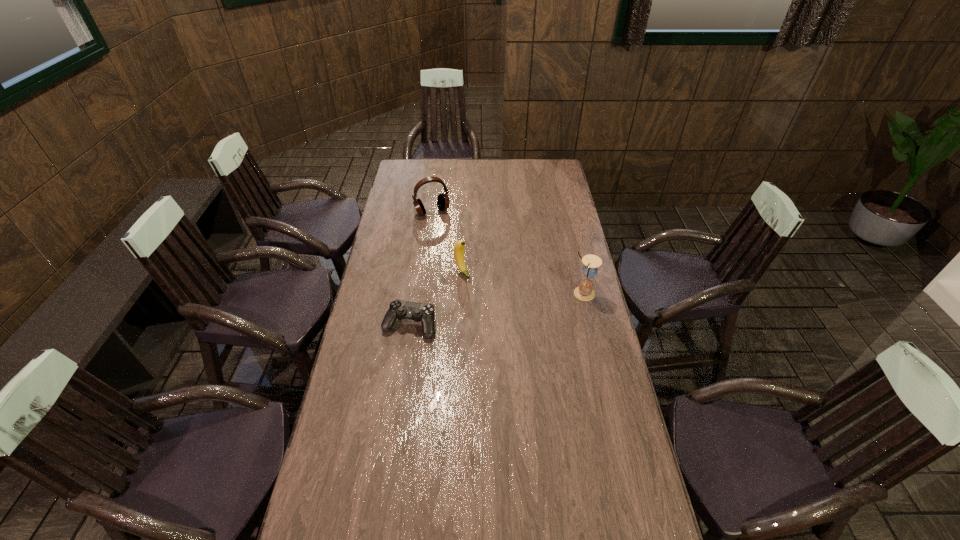
Identify the location of the shortest object. (425, 313).

This screenshot has width=960, height=540. Identify the location of the nearest object. (425, 313).

Image resolution: width=960 pixels, height=540 pixels. Find the location of `the rightmost object`. the rightmost object is located at coordinates (584, 291).

At what (x,y) coordinates should I click in order to perform the action: click on hourglass. Please return your answer as a coordinate pair (x, y). The image size is (960, 540). Looking at the image, I should click on (584, 291).

The height and width of the screenshot is (540, 960). What are the coordinates of `banana` in the screenshot? It's located at (459, 247).

At what (x,y) coordinates should I click in order to perform the action: click on the third object from left to right. Please return your answer as a coordinate pair (x, y). Looking at the image, I should click on click(x=459, y=247).

Find the location of a particular element. The width and height of the screenshot is (960, 540). headset is located at coordinates (443, 202).

You are a GUI agent. You are given a task and a screenshot of the screen. Output one action in this format:
    pyautogui.click(x=<x>, y=<y>)
    Task: Click on the vacant position located 0.110m on the right of the shortest object
    The image size is (960, 540).
    Given the screenshot: What is the action you would take?
    pyautogui.click(x=466, y=325)

Identify the location of vacant area situated on the back of the rightmost object. (572, 244).

You are a GUI agent. You are given a task and a screenshot of the screen. Output one action in this format:
    pyautogui.click(x=<x>, y=<y>)
    Task: Click on the vacant space situated from the stem of the second object from right to left
    
    Given the screenshot: What is the action you would take?
    pyautogui.click(x=485, y=300)